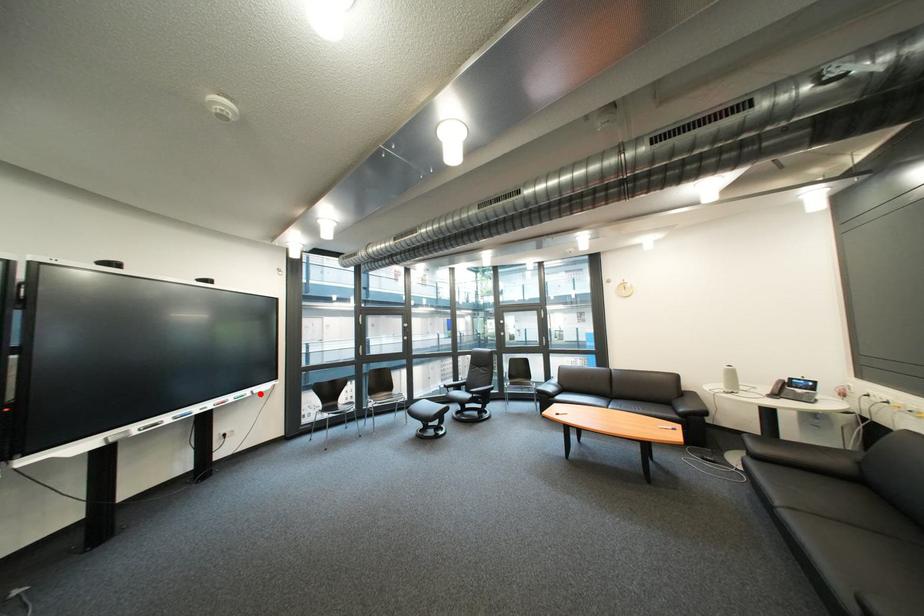
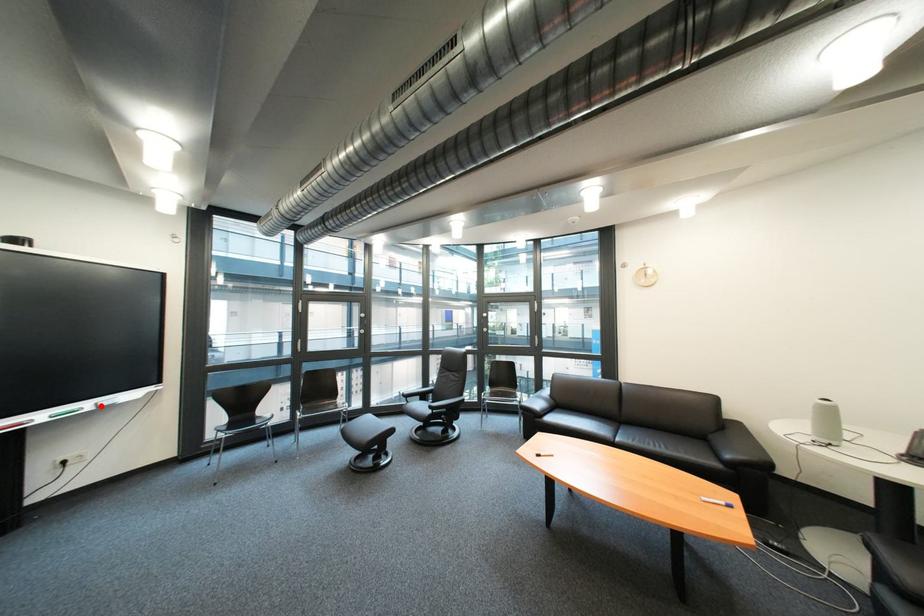
I am providing you with two images of the same scene from different viewpoints. A red point is marked on the first image and another point is marked on the second image. Is the red point in image1 aligned with the point shown in image2?

Yes